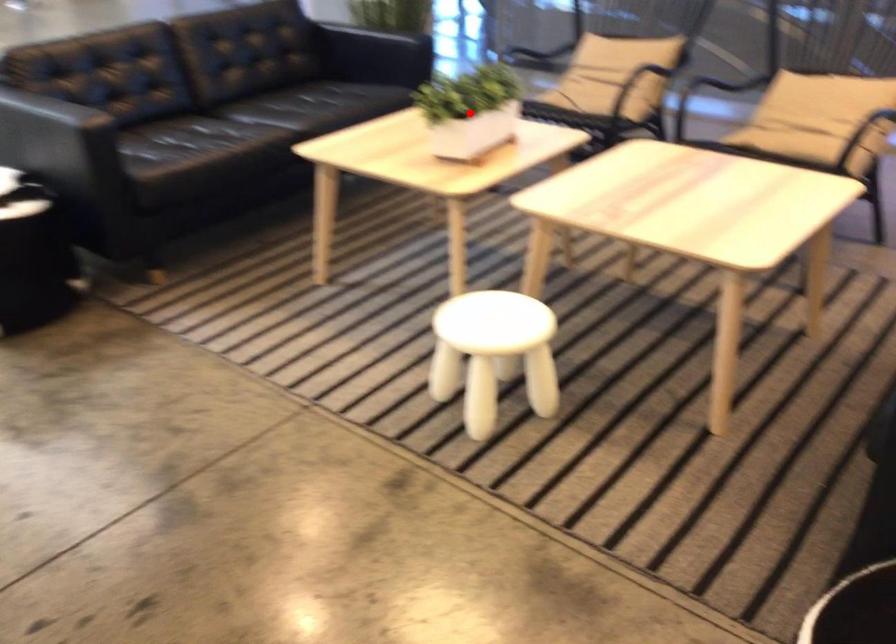
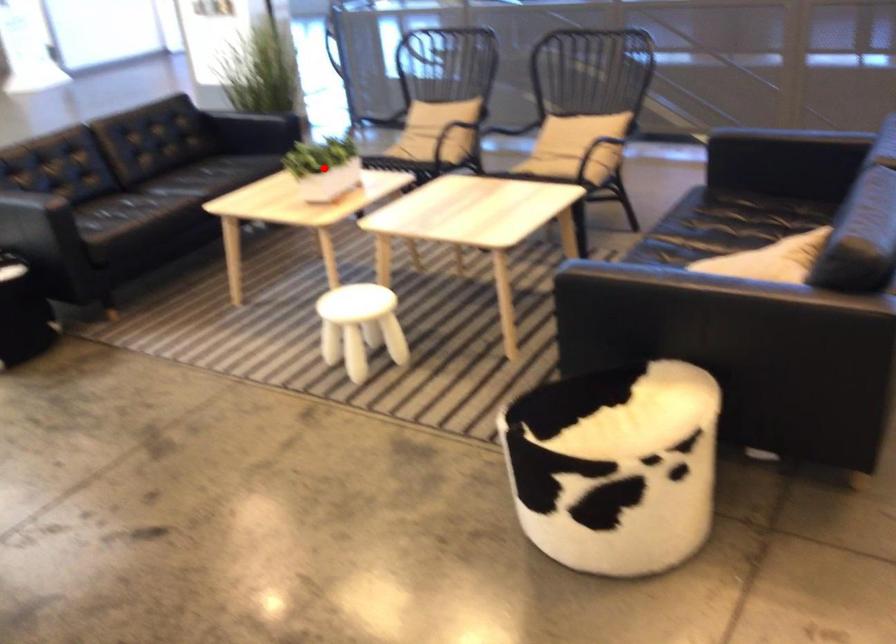
I am providing you with two images of the same scene from different viewpoints. A red point is marked on the first image and another point is marked on the second image. Are the points marked in image1 and image2 representing the same 3D position?

Yes